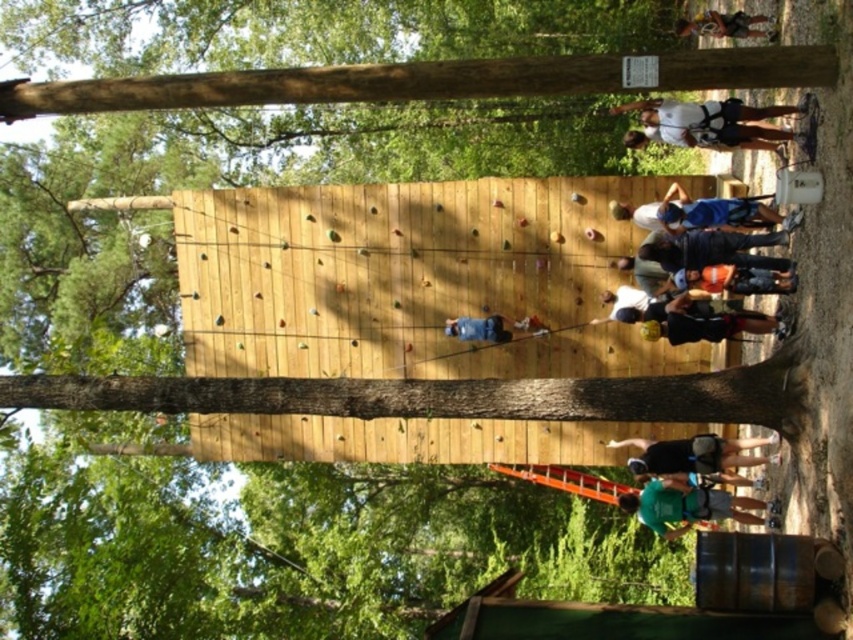
Question: Which point is closer to the camera?

Choices:
 (A) (720, 104)
 (B) (688, 336)

Answer: (A)

Question: Based on their relative distances, which object is farther from the blue denim jeans at center?

Choices:
 (A) blue fabric shirt at center
 (B) black fabric shirt at lower center
 (C) green fabric shirt at lower center

Answer: (A)

Question: Which object appears farthest from the camera in this image?

Choices:
 (A) black fabric shirt at lower center
 (B) dark blue shirt at upper right
 (C) black fabric backpack at lower center
 (D) green fabric shirt at lower center

Answer: (B)

Question: Is black fabric shirt at lower center positioned behind blue denim jeans at center?

Choices:
 (A) no
 (B) yes

Answer: (A)

Question: Is green fabric shirt at lower center further to the viewer compared to black fabric backpack at lower center?

Choices:
 (A) no
 (B) yes

Answer: (B)

Question: Can you confirm if dark blue shirt at center is bigger than dark blue shirt at upper right?

Choices:
 (A) yes
 (B) no

Answer: (B)